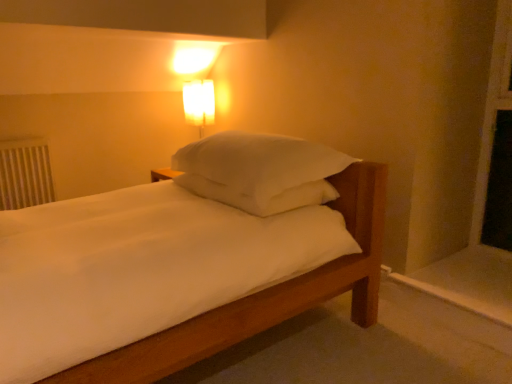
Question: Is white plastic radiator at left inside the boundaries of matte glass lampshade at upper center, or outside?

Choices:
 (A) inside
 (B) outside

Answer: (B)

Question: Considering the relative positions of white plastic radiator at left and matte glass lampshade at upper center in the image provided, is white plastic radiator at left to the left or to the right of matte glass lampshade at upper center?

Choices:
 (A) right
 (B) left

Answer: (B)

Question: Considering the real-world distances, which object is farthest from the white painted wood at lower right?

Choices:
 (A) white soft pillow at center
 (B) matte glass lampshade at upper center
 (C) wooden bed frame at lower center
 (D) white plastic radiator at left

Answer: (D)

Question: Estimate the real-world distances between objects in this image. Which object is closer to the wooden bed frame at lower center?

Choices:
 (A) white plastic radiator at left
 (B) white painted wood at lower right
 (C) white soft pillow at center
 (D) matte glass lampshade at upper center

Answer: (C)